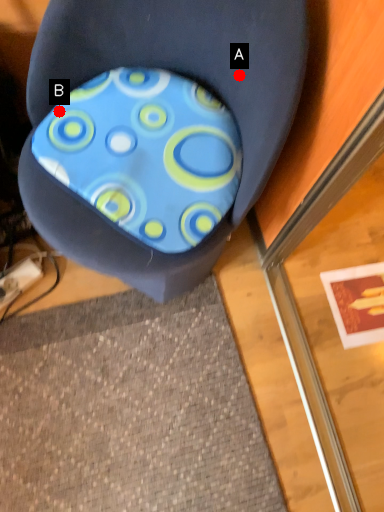
Question: Two points are circled on the image, labeled by A and B beside each circle. Which point is farther to the camera?

Choices:
 (A) A is further
 (B) B is further

Answer: (B)